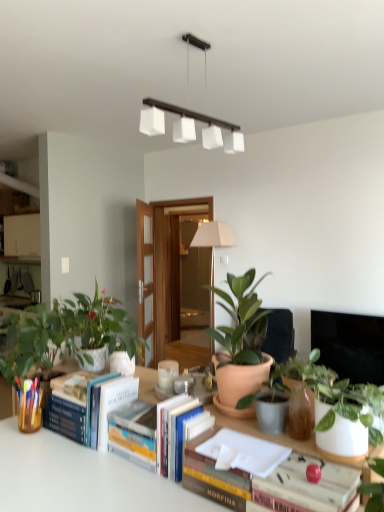
I want to click on free location above hardcover book at center, the 1th book positioned from the front (from a real-world perspective), so click(x=261, y=461).